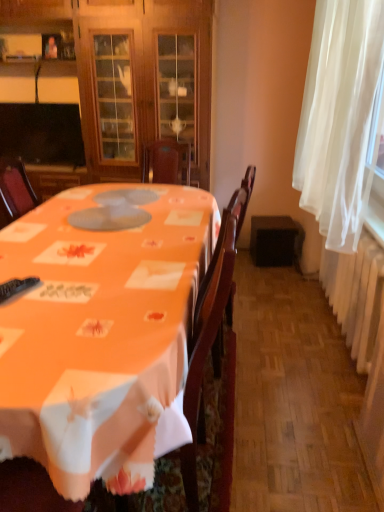
At what (x,y) coordinates should I click in order to perform the action: click on free space to the back side of black plastic remote control at lower left. Please return your answer as a coordinate pair (x, y). The image size is (384, 512). Looking at the image, I should click on (41, 270).